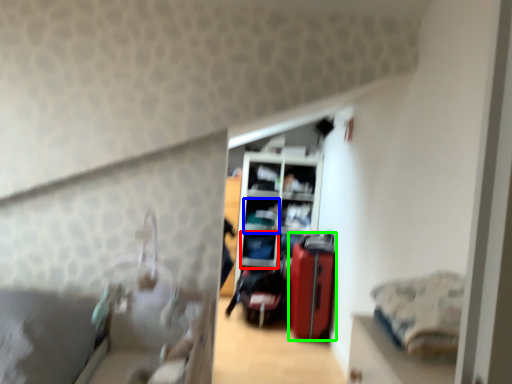
Question: Which object is the farthest from shelf (highlighted by a red box)? Choose among these: shelf (highlighted by a blue box) or luggage (highlighted by a green box).

Choices:
 (A) shelf
 (B) luggage

Answer: (B)